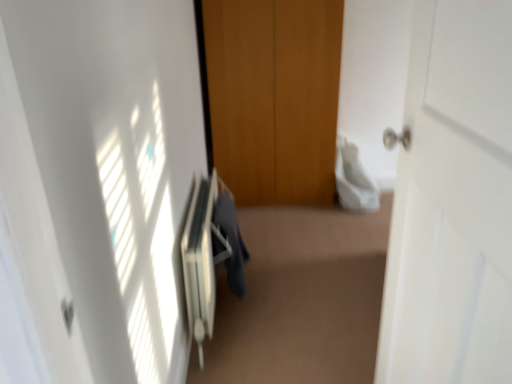
Describe the element at coordinates (231, 239) in the screenshot. I see `dark gray fabric at center` at that location.

In order to click on white plastic radiator at center in this screenshot , I will do `click(200, 261)`.

Identify the location of dark gray fabric at center. (231, 239).

What's the angular difference between dark gray fabric at center and white matte door at right's facing directions?

The angular difference between dark gray fabric at center and white matte door at right is 91 degrees.

Can you confirm if dark gray fabric at center is wider than white matte door at right?

No, dark gray fabric at center is not wider than white matte door at right.

Is dark gray fabric at center oriented towards white matte door at right?

No.

Is point (230, 275) positioned in front of point (476, 363)?

No, it is not.

Between white plastic radiator at center and dark gray fabric at center, which one has larger width?

With larger width is white plastic radiator at center.

From a real-world perspective, is white plastic radiator at center on top of dark gray fabric at center?

No, from a real-world perspective, white plastic radiator at center is not over dark gray fabric at center

Consider the image. How many degrees apart are the facing directions of white plastic radiator at center and dark gray fabric at center?

The angle between the facing direction of white plastic radiator at center and the facing direction of dark gray fabric at center is 0.00289 degrees.

Is white plastic radiator at center far from dark gray fabric at center?

That's not correct — white plastic radiator at center is a little close to dark gray fabric at center.

Can you confirm if dark gray fabric at center is positioned to the right of white plastic radiator at center?

Correct, you'll find dark gray fabric at center to the right of white plastic radiator at center.

From the image's perspective, is dark gray fabric at center on white plastic radiator at center?

Indeed, from the image's perspective, dark gray fabric at center is shown above white plastic radiator at center.

Considering the sizes of objects dark gray fabric at center and white plastic radiator at center in the image provided, who is wider, dark gray fabric at center or white plastic radiator at center?

With larger width is white plastic radiator at center.

Is white plastic radiator at center located within dark gray fabric at center?

No, white plastic radiator at center is located outside of dark gray fabric at center.

Can you confirm if white plastic radiator at center is taller than white matte door at right?

No.

Considering the sizes of white plastic radiator at center and white matte door at right in the image, is white plastic radiator at center wider or thinner than white matte door at right?

In the image, white plastic radiator at center appears to be more narrow than white matte door at right.

Who is bigger, white plastic radiator at center or white matte door at right?

white matte door at right is bigger.

What's the angular difference between white plastic radiator at center and white matte door at right's facing directions?

The angular difference between white plastic radiator at center and white matte door at right is 91 degrees.

Considering the relative positions of white matte door at right and white plastic radiator at center in the image provided, is white matte door at right to the left or to the right of white plastic radiator at center?

Based on their positions, white matte door at right is located to the right of white plastic radiator at center.

In terms of width, does white matte door at right look wider or thinner when compared to white plastic radiator at center?

In the image, white matte door at right appears to be wider than white plastic radiator at center.

Identify the location of door that appears above the white plastic radiator at center (from a real-world perspective). Image resolution: width=512 pixels, height=384 pixels. (453, 203).

In the scene shown: Is white matte door at right oriented towards white plastic radiator at center?

No, white matte door at right is not facing towards white plastic radiator at center.

Considering the relative positions of white matte door at right and dark gray fabric at center in the image provided, is white matte door at right in front of dark gray fabric at center?

Yes, white matte door at right is closer to the viewer.

Is dark gray fabric at center completely or partially inside white matte door at right?

Definitely not — dark gray fabric at center is not inside white matte door at right.

Between white matte door at right and dark gray fabric at center, which one appears on the right side from the viewer's perspective?

white matte door at right is more to the right.

Is white matte door at right bigger than dark gray fabric at center?

Yes.

Where is `laundry behind the white matte door at right`? The height and width of the screenshot is (384, 512). laundry behind the white matte door at right is located at coordinates (231, 239).

Image resolution: width=512 pixels, height=384 pixels. I want to click on laundry that appears on the right of white plastic radiator at center, so click(231, 239).

Which object lies nearer to the anchor point white plastic radiator at center, dark gray fabric at center or white matte door at right?

The object closer to white plastic radiator at center is dark gray fabric at center.

From the picture: Estimate the real-world distances between objects in this image. Which object is closer to white matte door at right, dark gray fabric at center or white plastic radiator at center?

white plastic radiator at center is positioned closer to the anchor white matte door at right.

Looking at the image, which one is located further to dark gray fabric at center, white matte door at right or white plastic radiator at center?

white matte door at right lies further to dark gray fabric at center than the other object.

Looking at the image, which one is located closer to white plastic radiator at center, white matte door at right or dark gray fabric at center?

Based on the image, dark gray fabric at center appears to be nearer to white plastic radiator at center.

In the scene shown: Looking at the image, which one is located closer to white matte door at right, white plastic radiator at center or dark gray fabric at center?

Based on the image, white plastic radiator at center appears to be nearer to white matte door at right.

Looking at the image, which one is located closer to dark gray fabric at center, white plastic radiator at center or white matte door at right?

The object closer to dark gray fabric at center is white plastic radiator at center.

The width and height of the screenshot is (512, 384). Find the location of `radiator between white matte door at right and dark gray fabric at center along the z-axis`. radiator between white matte door at right and dark gray fabric at center along the z-axis is located at coordinates (x=200, y=261).